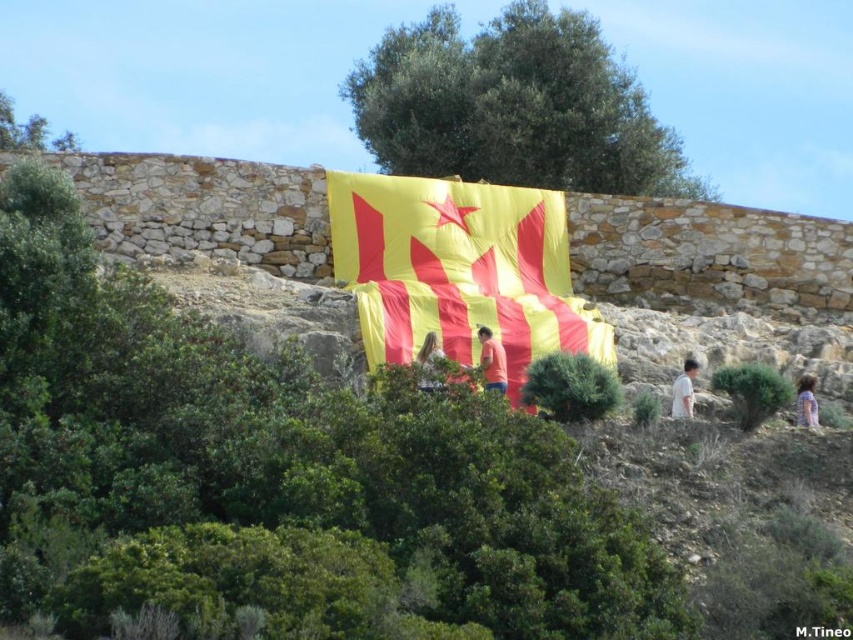
Who is lower down, matte red shirt at center or light brown hair at center?

light brown hair at center is lower down.

Is matte red shirt at center positioned before light brown hair at center?

Yes, it is in front of light brown hair at center.

This screenshot has width=853, height=640. I want to click on matte red shirt at center, so click(491, 362).

The image size is (853, 640). What are the coordinates of `matte red shirt at center` in the screenshot? It's located at (491, 362).

Does yellowmaterial/textureflag at center appear over light brown hair at center?

Yes, yellowmaterial/textureflag at center is above light brown hair at center.

Identify the location of yellowmaterial/textureflag at center. The image size is (853, 640). (459, 269).

Who is more distant from viewer, (682,385) or (799,410)?

Positioned behind is point (799,410).

Is light brown hair at center positioned in front of light brown hair at right?

No, light brown hair at center is behind light brown hair at right.

Between point (683, 378) and point (804, 388), which one is positioned in front?

Point (683, 378)

The image size is (853, 640). I want to click on light brown hair at center, so click(x=683, y=390).